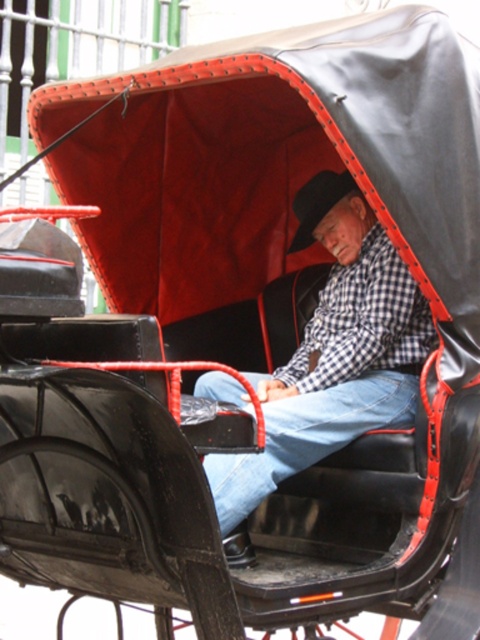
Is checkered fabric shirt at center thinner than blue denim jeans at center?

No, checkered fabric shirt at center is not thinner than blue denim jeans at center.

Between checkered fabric shirt at center and blue denim jeans at center, which one is positioned lower?

Positioned lower is blue denim jeans at center.

You are a GUI agent. You are given a task and a screenshot of the screen. Output one action in this format:
    pyautogui.click(x=<x>, y=<y>)
    Task: Click on the checkered fabric shirt at center
    The height and width of the screenshot is (640, 480).
    Given the screenshot: What is the action you would take?
    pyautogui.click(x=332, y=356)